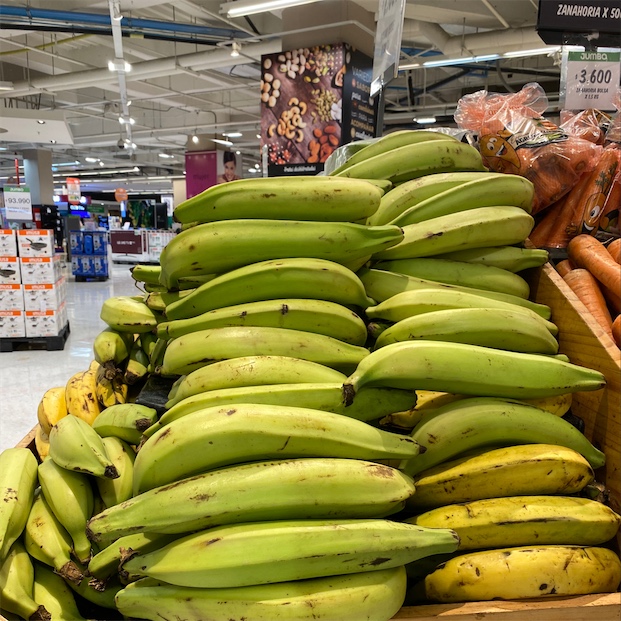
Locate an element on the screen. floor display is located at coordinates (24, 286), (93, 238), (132, 233).